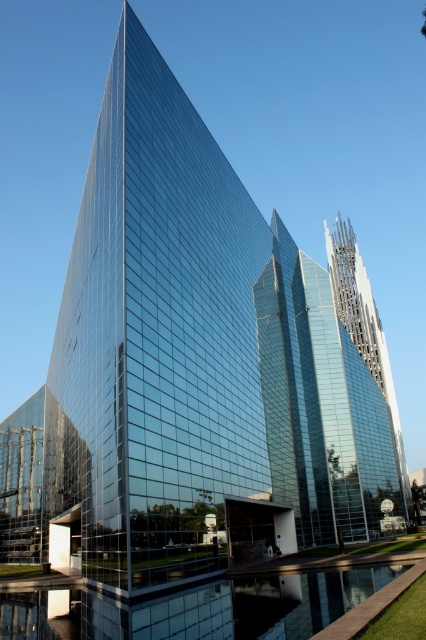
Can you confirm if transparent glass water at lower center is positioned below clear glass tower at center?

Indeed, transparent glass water at lower center is positioned under clear glass tower at center.

Does transparent glass water at lower center have a larger size compared to clear glass tower at center?

No.

Which is behind, point (48, 625) or point (391, 396)?

The point (391, 396) is behind.

Where is `transparent glass water at lower center`? This screenshot has width=426, height=640. transparent glass water at lower center is located at coordinates (198, 609).